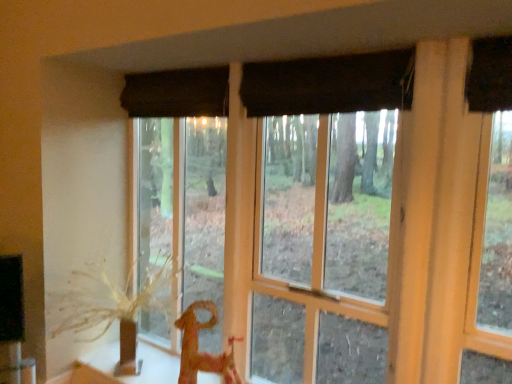
Question: Does brown textured plant at left have a larger size compared to wooden horse at lower center?

Choices:
 (A) yes
 (B) no

Answer: (A)

Question: Is brown textured plant at left wider than wooden horse at lower center?

Choices:
 (A) no
 (B) yes

Answer: (B)

Question: From a real-world perspective, is brown textured plant at left on top of wooden horse at lower center?

Choices:
 (A) no
 (B) yes

Answer: (B)

Question: From a real-world perspective, is brown textured plant at left under wooden horse at lower center?

Choices:
 (A) no
 (B) yes

Answer: (A)

Question: Considering the relative positions of brown textured plant at left and wooden horse at lower center in the image provided, is brown textured plant at left to the left of wooden horse at lower center from the viewer's perspective?

Choices:
 (A) yes
 (B) no

Answer: (A)

Question: Is brown textured plant at left further to camera compared to wooden horse at lower center?

Choices:
 (A) no
 (B) yes

Answer: (A)

Question: Is black fabric curtain at upper center oriented away from matte brown curtain at center?

Choices:
 (A) no
 (B) yes

Answer: (B)

Question: Considering the relative sizes of black fabric curtain at upper center and matte brown curtain at center in the image provided, is black fabric curtain at upper center smaller than matte brown curtain at center?

Choices:
 (A) no
 (B) yes

Answer: (B)

Question: Considering the relative sizes of black fabric curtain at upper center and matte brown curtain at center in the image provided, is black fabric curtain at upper center thinner than matte brown curtain at center?

Choices:
 (A) yes
 (B) no

Answer: (A)

Question: From a real-world perspective, is black fabric curtain at upper center physically below matte brown curtain at center?

Choices:
 (A) yes
 (B) no

Answer: (B)

Question: Would you say black fabric curtain at upper center is a long distance from matte brown curtain at center?

Choices:
 (A) no
 (B) yes

Answer: (A)

Question: Is black fabric curtain at upper center wider than matte brown curtain at center?

Choices:
 (A) yes
 (B) no

Answer: (B)

Question: Does wooden horse at lower center appear on the right side of brown textured plant at left?

Choices:
 (A) yes
 (B) no

Answer: (A)